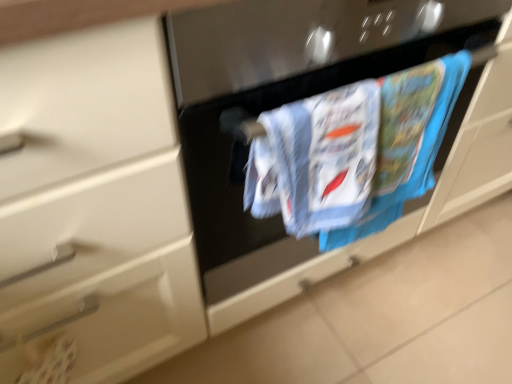
Question: Considering the relative sizes of printed cotton towel at center and white plastic door handle at lower left in the image provided, is printed cotton towel at center wider than white plastic door handle at lower left?

Choices:
 (A) no
 (B) yes

Answer: (B)

Question: Can you confirm if printed cotton towel at center is thinner than white plastic door handle at lower left?

Choices:
 (A) no
 (B) yes

Answer: (A)

Question: From the image's perspective, does printed cotton towel at center appear lower than white plastic door handle at lower left?

Choices:
 (A) yes
 (B) no

Answer: (B)

Question: Is printed cotton towel at center to the right of white plastic door handle at lower left from the viewer's perspective?

Choices:
 (A) yes
 (B) no

Answer: (A)

Question: Considering the relative sizes of printed cotton towel at center and white plastic door handle at lower left in the image provided, is printed cotton towel at center shorter than white plastic door handle at lower left?

Choices:
 (A) yes
 (B) no

Answer: (B)

Question: Is white plastic door handle at lower left a part of printed cotton towel at center?

Choices:
 (A) no
 (B) yes

Answer: (A)

Question: From a real-world perspective, is white plastic door handle at lower left beneath printed cotton towel at center?

Choices:
 (A) yes
 (B) no

Answer: (A)

Question: Is white plastic door handle at lower left in contact with printed cotton towel at center?

Choices:
 (A) yes
 (B) no

Answer: (B)

Question: Is white plastic door handle at lower left behind printed cotton towel at center?

Choices:
 (A) no
 (B) yes

Answer: (B)

Question: Can we say white plastic door handle at lower left lies outside printed cotton towel at center?

Choices:
 (A) yes
 (B) no

Answer: (A)

Question: From a real-world perspective, is white plastic door handle at lower left positioned over printed cotton towel at center based on gravity?

Choices:
 (A) no
 (B) yes

Answer: (A)

Question: From the image's perspective, does white plastic door handle at lower left appear higher than printed cotton towel at center?

Choices:
 (A) yes
 (B) no

Answer: (B)

Question: In terms of size, does printed cotton towel at center appear bigger or smaller than white plastic door handle at lower left?

Choices:
 (A) big
 (B) small

Answer: (A)